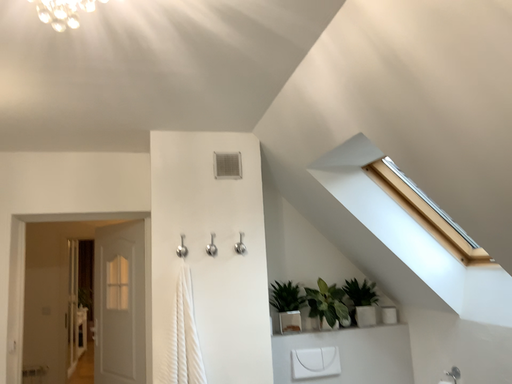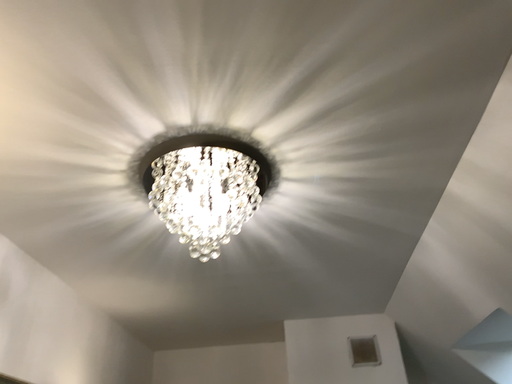
Question: How did the camera likely rotate when shooting the video?

Choices:
 (A) rotated right
 (B) rotated left

Answer: (B)